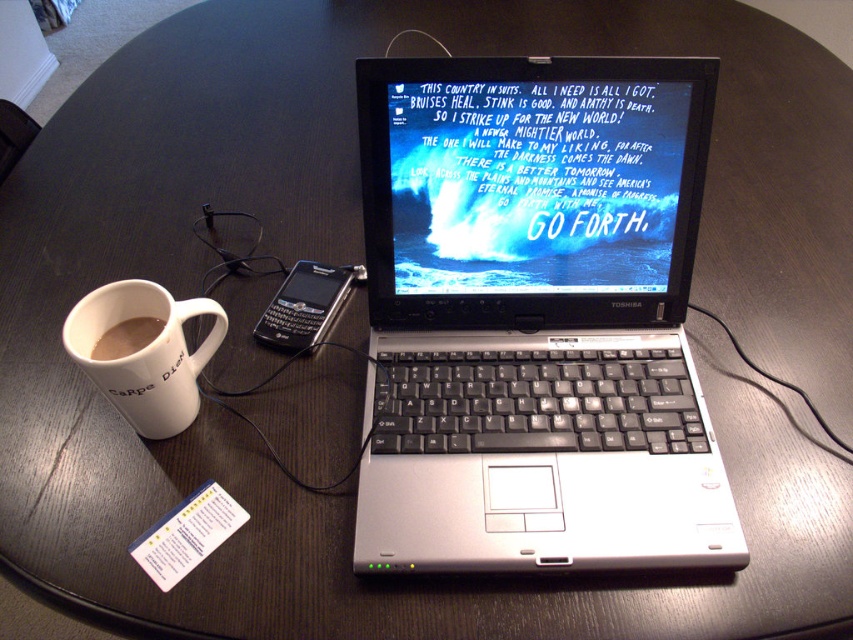
Does white ceramic mug at left have a lesser width compared to black plastic smartphone at center?

No.

Who is positioned more to the left, white ceramic mug at left or black plastic smartphone at center?

white ceramic mug at left

The width and height of the screenshot is (853, 640). What are the coordinates of `white ceramic mug at left` in the screenshot? It's located at (144, 353).

Find the location of `white ceramic mug at left`. white ceramic mug at left is located at coordinates click(x=144, y=353).

Is silver/black keyboard at center below black plastic smartphone at center?

Yes.

Does silver/black keyboard at center appear over black plastic smartphone at center?

Incorrect, silver/black keyboard at center is not positioned above black plastic smartphone at center.

Does point (697, 106) lie in front of point (265, 316)?

Yes.

You are a GUI agent. You are given a task and a screenshot of the screen. Output one action in this format:
    pyautogui.click(x=<x>, y=<y>)
    Task: Click on the silver/black keyboard at center
    This screenshot has width=853, height=640.
    Given the screenshot: What is the action you would take?
    pyautogui.click(x=535, y=316)

Is point (343, 292) closer to viewer compared to point (96, 349)?

No, (343, 292) is behind (96, 349).

Where is `black plastic smartphone at center`? The image size is (853, 640). black plastic smartphone at center is located at coordinates (305, 305).

What are the coordinates of `black plastic smartphone at center` in the screenshot? It's located at (305, 305).

Identify the location of black plastic smartphone at center. This screenshot has height=640, width=853. (305, 305).